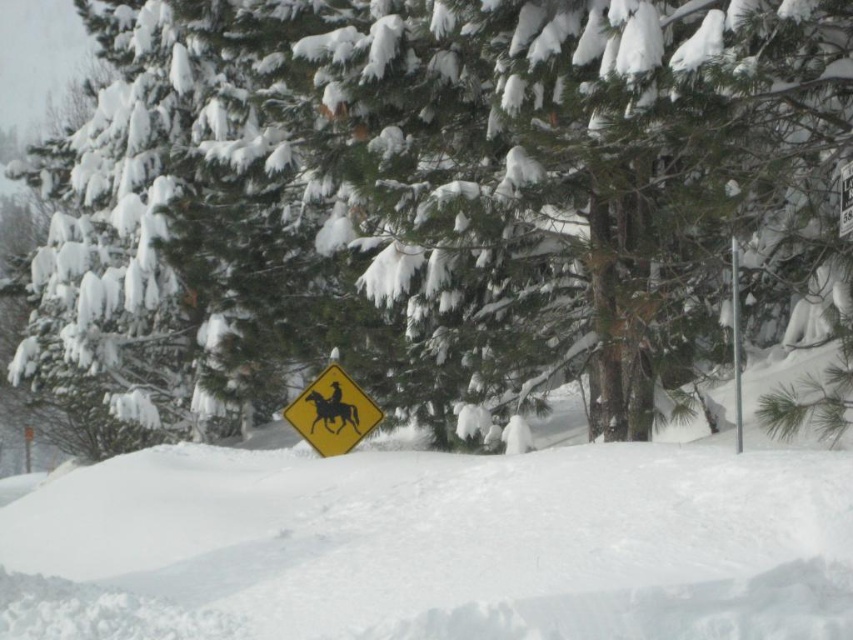
Question: Does yellow diamond-shaped sign at center have a larger size compared to smooth yellow sign at center?

Choices:
 (A) no
 (B) yes

Answer: (B)

Question: Considering the relative positions of snow-covered evergreen tree at center and smooth yellow sign at center in the image provided, where is snow-covered evergreen tree at center located with respect to smooth yellow sign at center?

Choices:
 (A) left
 (B) right

Answer: (A)

Question: Does white fluffy snow at lower center have a larger size compared to smooth yellow sign at center?

Choices:
 (A) yes
 (B) no

Answer: (A)

Question: Which of the following is the farthest from the observer?

Choices:
 (A) yellow diamond-shaped sign at center
 (B) smooth yellow sign at center
 (C) snow-covered evergreen tree at center

Answer: (B)

Question: Which of the following is the farthest from the observer?

Choices:
 (A) white fluffy snow at lower center
 (B) snow-covered evergreen tree at center
 (C) smooth yellow sign at center
 (D) yellow diamond-shaped sign at center

Answer: (C)

Question: Which point is farther to the camera?

Choices:
 (A) (310, 428)
 (B) (515, 637)
 (C) (318, 419)
 (D) (508, 88)

Answer: (C)